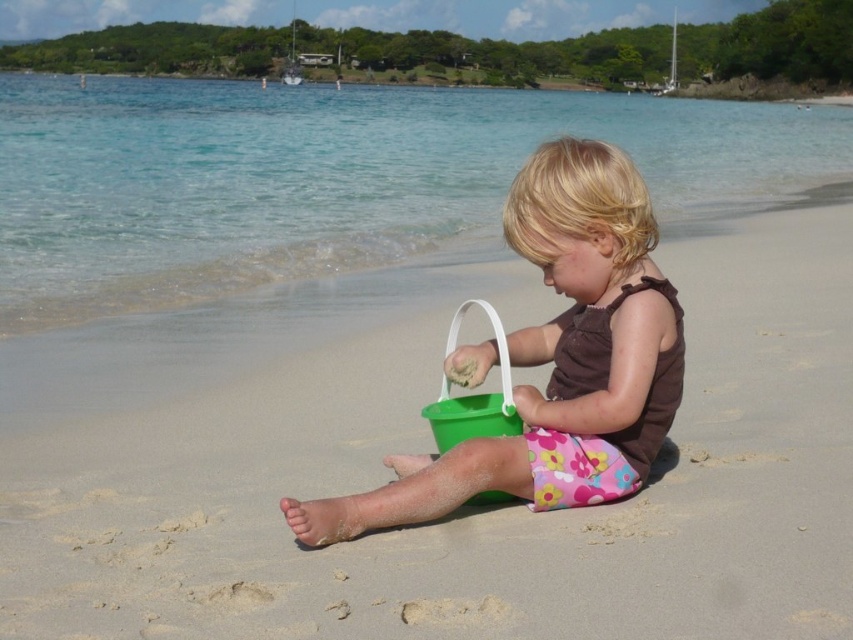
Is green matte bucket at center smaller than matte green bucket at center?

Yes, green matte bucket at center is smaller than matte green bucket at center.

Is green matte bucket at center shorter than matte green bucket at center?

Correct, green matte bucket at center is not as tall as matte green bucket at center.

Who is more forward, (416, 531) or (648, 278)?

Result: Point (416, 531)

Identify the location of green matte bucket at center. (473, 515).

Can you confirm if clear blue water at upper center is wider than matte green bucket at center?

Indeed, clear blue water at upper center has a greater width compared to matte green bucket at center.

In order to click on clear blue water at upper center in this screenshot , I will do `click(328, 179)`.

Identify the location of clear blue water at upper center. The image size is (853, 640). (328, 179).

Is green matte bucket at center further to the viewer compared to clear blue water at upper center?

No.

Is green matte bucket at center below clear blue water at upper center?

Yes.

The image size is (853, 640). I want to click on green matte bucket at center, so click(473, 515).

I want to click on green matte bucket at center, so click(x=473, y=515).